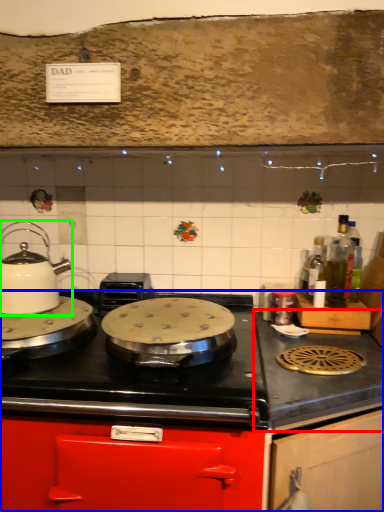
Question: Which object is the closest to the counter top (highlighted by a red box)? Choose among these: cabinetry (highlighted by a blue box) or kitchen appliance (highlighted by a green box).

Choices:
 (A) cabinetry
 (B) kitchen appliance

Answer: (A)